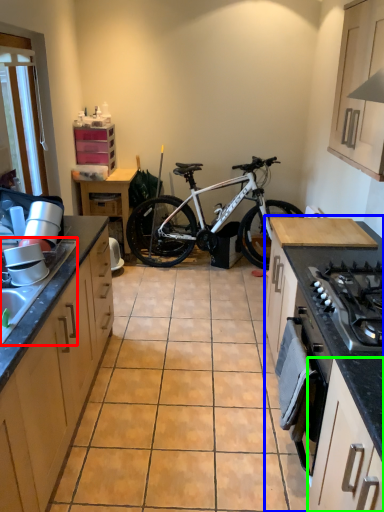
Question: Estimate the real-world distances between objects in this image. Which object is closer to sink (highlighted by a red box), countertop (highlighted by a blue box) or cabinetry (highlighted by a green box)?

Choices:
 (A) countertop
 (B) cabinetry

Answer: (B)